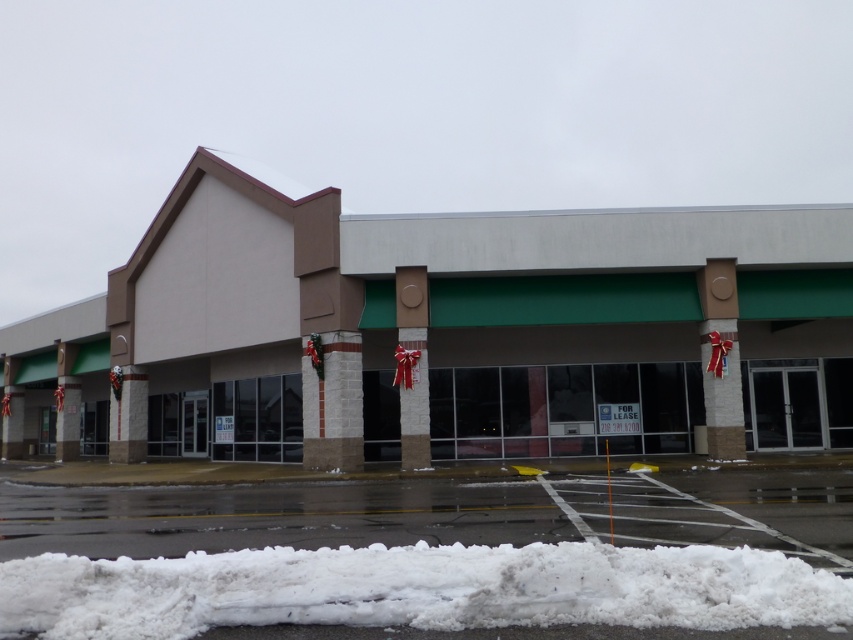
Is white concrete building at center to the left of white fluffy snow at lower center from the viewer's perspective?

Indeed, white concrete building at center is positioned on the left side of white fluffy snow at lower center.

Which of these two, white concrete building at center or white fluffy snow at lower center, stands shorter?

white fluffy snow at lower center

Between point (816, 387) and point (302, 602), which one is positioned in front?

Point (302, 602) is more forward.

The width and height of the screenshot is (853, 640). Identify the location of white concrete building at center. (442, 333).

Is white concrete building at center bigger than white asphalt parking lot at lower center?

Indeed, white concrete building at center has a larger size compared to white asphalt parking lot at lower center.

Between white concrete building at center and white asphalt parking lot at lower center, which one has less height?

Standing shorter between the two is white asphalt parking lot at lower center.

Which is in front, point (381, 259) or point (776, 513)?

Point (776, 513)

Identify the location of white concrete building at center. (442, 333).

Based on the photo, is white fluffy snow at lower center shorter than brown textured pillar at center?

Indeed, white fluffy snow at lower center has a lesser height compared to brown textured pillar at center.

Does white fluffy snow at lower center have a lesser width compared to brown textured pillar at center?

In fact, white fluffy snow at lower center might be wider than brown textured pillar at center.

In the scene shown: Who is more distant from viewer, (38, 602) or (407, 410)?

The point (407, 410) is behind.

Find the location of a particular element. The width and height of the screenshot is (853, 640). white fluffy snow at lower center is located at coordinates (416, 589).